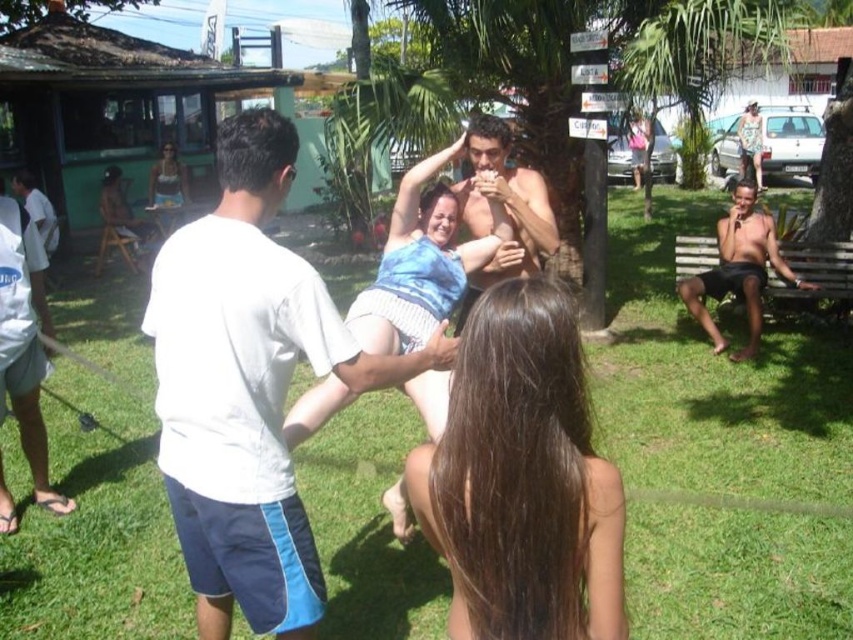
Question: Is white cotton shirt at center smaller than blue tie-dye bikini top at upper left?

Choices:
 (A) no
 (B) yes

Answer: (B)

Question: Which object is positioned closest to the tan skin man at right?

Choices:
 (A) blue tie-dye shirt at center
 (B) blue tie-dye bikini top at center

Answer: (A)

Question: Is green grass at center further to the viewer compared to white cotton shirt at left?

Choices:
 (A) no
 (B) yes

Answer: (A)

Question: Is blue tie-dye shirt at center thinner than white cotton shirt at left?

Choices:
 (A) yes
 (B) no

Answer: (B)

Question: Which object is farther from the camera taking this photo?

Choices:
 (A) tan skin man at right
 (B) brown hair at center
 (C) shiny skin at center
 (D) green leafy palm tree at upper center

Answer: (A)

Question: Which point is closer to the camera?

Choices:
 (A) brown hair at center
 (B) tan skin man at right

Answer: (A)